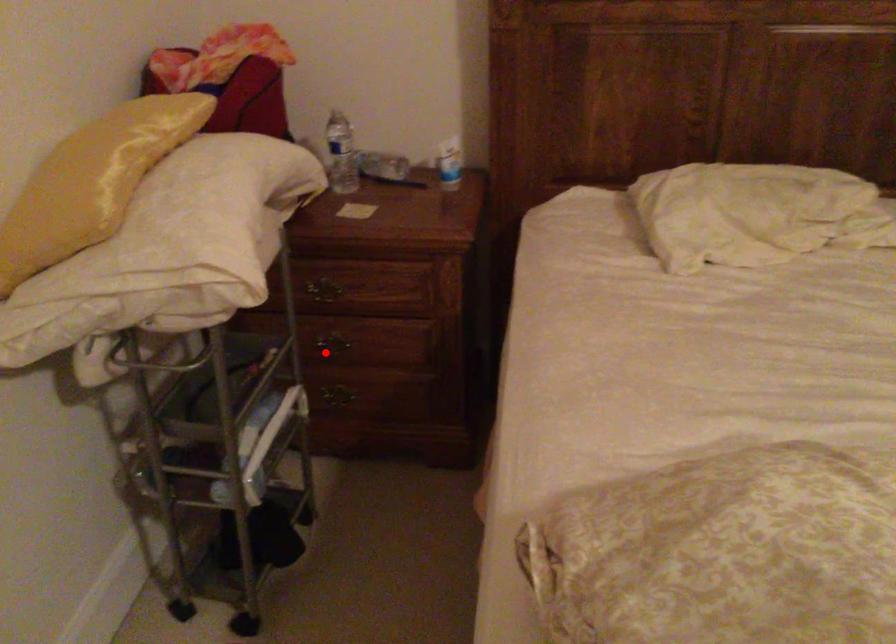
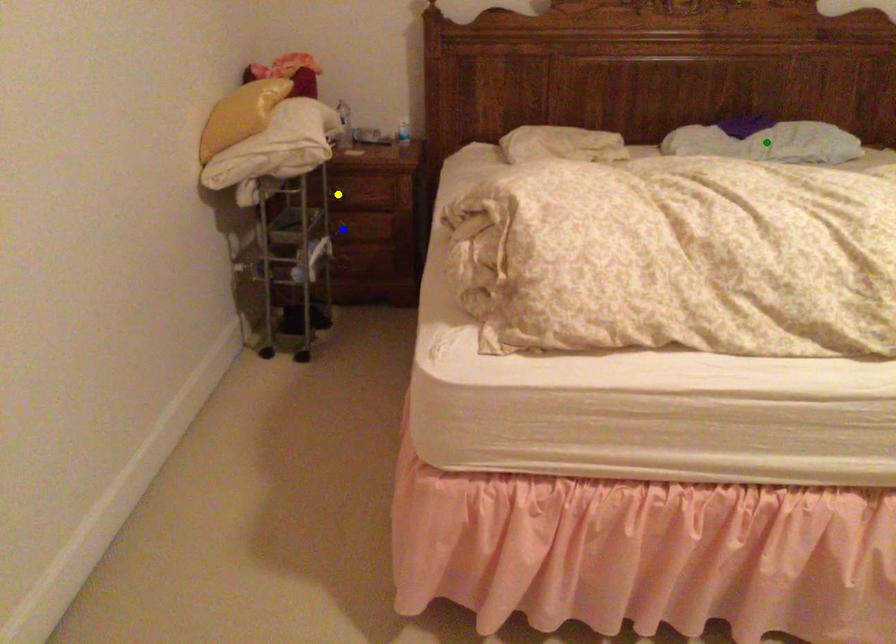
Question: I am providing you with two images of the same scene from different viewpoints. A red point is marked on the first image. You are given multiple points on the second image. Which mark in image 2 goes with the point in image 1?

Choices:
 (A) blue point
 (B) yellow point
 (C) green point

Answer: (A)